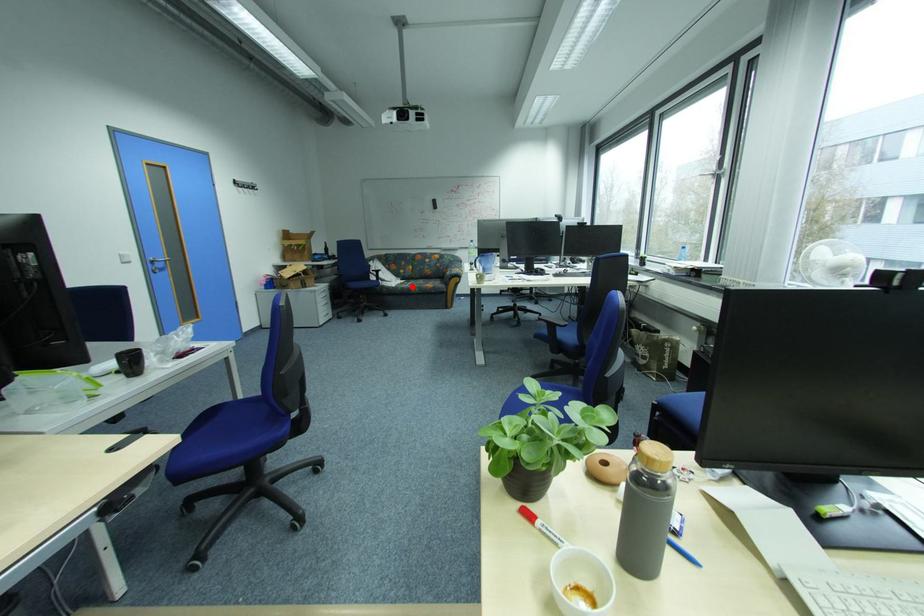
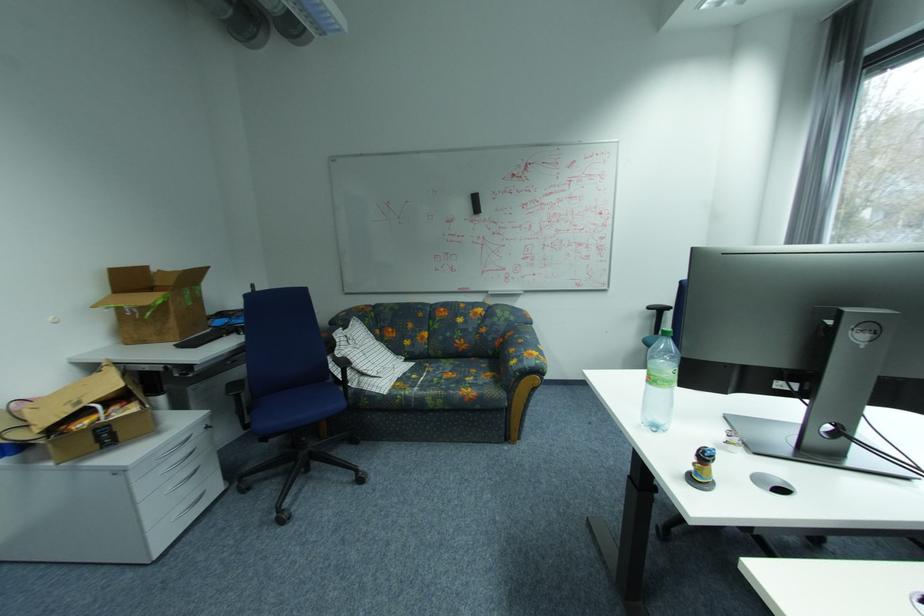
Question: I am providing you with two images of the same scene from different viewpoints. In image1, a red point is highlighted. Considering the same 3D point in image2, which of the following is correct?

Choices:
 (A) It is closer
 (B) It is farther

Answer: (B)